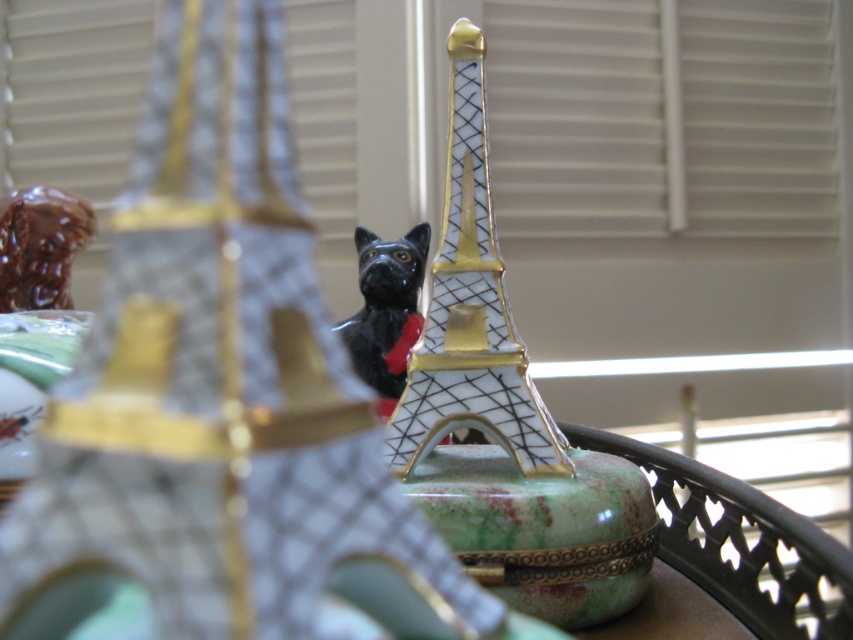
Question: Observing the image, what is the correct spatial positioning of matte black cat at center in reference to black glossy cat at center?

Choices:
 (A) right
 (B) left

Answer: (A)

Question: Which object is farther from the camera taking this photo?

Choices:
 (A) matte black cat at center
 (B) porcelain eiffel tower at center

Answer: (B)

Question: Is matte black cat at center positioned at the back of porcelain eiffel tower at center?

Choices:
 (A) no
 (B) yes

Answer: (A)

Question: Does matte black cat at center appear on the right side of porcelain eiffel tower at center?

Choices:
 (A) no
 (B) yes

Answer: (A)

Question: Which is nearer to the porcelain eiffel tower at center?

Choices:
 (A) black glossy cat at center
 (B) matte black cat at center

Answer: (A)

Question: Which of the following is the closest to the observer?

Choices:
 (A) (360, 339)
 (B) (367, 426)

Answer: (B)